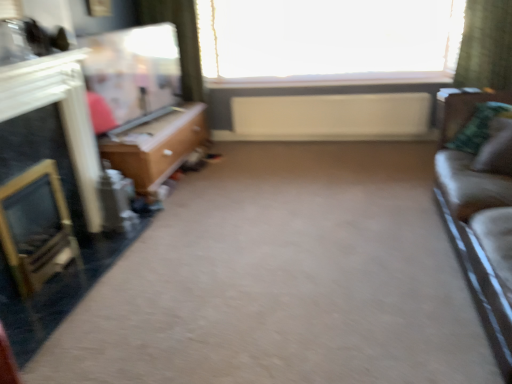
Find the location of a particular element. This screenshot has width=512, height=384. empty space that is ontop of white matte radiator at center (from a real-world perspective) is located at coordinates (312, 99).